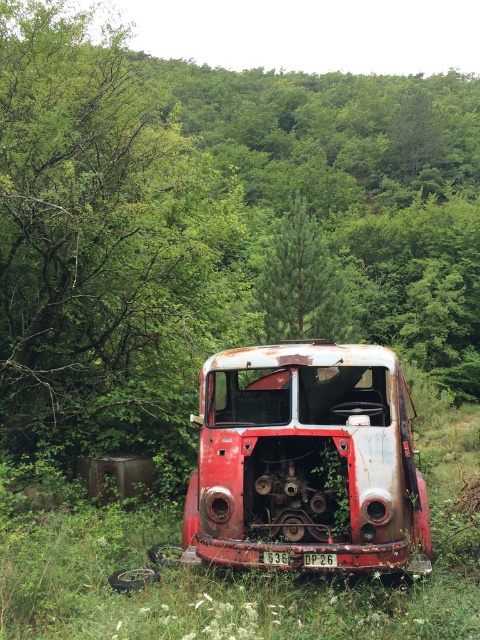
Question: Among these objects, which one is nearest to the camera?

Choices:
 (A) green leafy forest at center
 (B) green grass at center

Answer: (B)

Question: Is green leafy forest at center further to the viewer compared to rusty metal truck at center?

Choices:
 (A) yes
 (B) no

Answer: (A)

Question: Is green leafy forest at center positioned at the back of green grass at center?

Choices:
 (A) yes
 (B) no

Answer: (A)

Question: Which object is positioned farthest from the rusty metal truck at center?

Choices:
 (A) green grass at center
 (B) green leafy forest at center

Answer: (B)

Question: Can you confirm if rusty metal truck at center is thinner than green leafy tree at center?

Choices:
 (A) no
 (B) yes

Answer: (B)

Question: Which object appears farthest from the camera in this image?

Choices:
 (A) green grass at center
 (B) rusty metal truck at center
 (C) green leafy tree at center

Answer: (C)